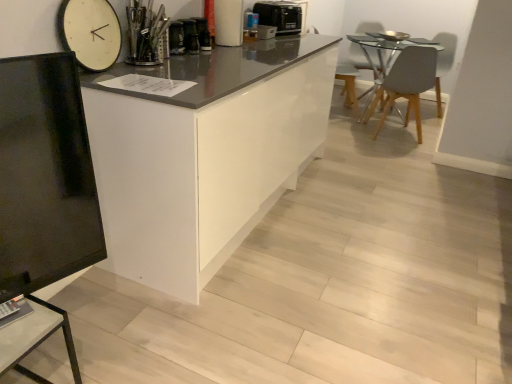
The image size is (512, 384). What do you see at coordinates (281, 15) in the screenshot? I see `black plastic toaster at upper center` at bounding box center [281, 15].

This screenshot has height=384, width=512. What are the coordinates of `white glossy cabinet at center` in the screenshot? It's located at (204, 154).

The width and height of the screenshot is (512, 384). In order to click on matte black tv stand at lower left in this screenshot , I will do `click(35, 339)`.

Looking at this image, how much space does matte gray swivel chair at upper right, the first swivel chair viewed from the right, occupy vertically?

matte gray swivel chair at upper right, the first swivel chair viewed from the right, is 31.94 inches tall.

At what (x,y) coordinates should I click in order to perform the action: click on matte gray swivel chair at upper right, the first swivel chair in the left-to-right sequence. Please return your answer as a coordinate pair (x, y). The height and width of the screenshot is (384, 512). Looking at the image, I should click on (362, 57).

At what (x,y) coordinates should I click in order to perform the action: click on gray matte chair at right. Please return your answer as a coordinate pair (x, y). The width and height of the screenshot is (512, 384). Looking at the image, I should click on (406, 84).

From a real-world perspective, who is located lower, matte gray swivel chair at upper right, the second swivel chair from the right, or matte black tv stand at lower left?

matte black tv stand at lower left.

Is matte gray swivel chair at upper right, the second swivel chair from the right, outside of matte black tv stand at lower left?

matte gray swivel chair at upper right, the second swivel chair from the right, is positioned outside matte black tv stand at lower left.

Is matte gray swivel chair at upper right, the second swivel chair from the right, wider than matte black tv stand at lower left?

Correct, the width of matte gray swivel chair at upper right, the second swivel chair from the right, exceeds that of matte black tv stand at lower left.

Is matte gray swivel chair at upper right, the first swivel chair in the left-to-right sequence, taller than matte black tv stand at lower left?

Indeed, matte gray swivel chair at upper right, the first swivel chair in the left-to-right sequence, has a greater height compared to matte black tv stand at lower left.

Which is farther, (119, 34) or (445, 59)?

The point (445, 59) is behind.

Does white wooden clock at upper left come behind matte gray swivel chair at upper right, the 2th swivel chair positioned from the left?

No, it is in front of matte gray swivel chair at upper right, the 2th swivel chair positioned from the left.

Can you confirm if white wooden clock at upper left is wider than matte gray swivel chair at upper right, the 2th swivel chair positioned from the left?

Incorrect, the width of white wooden clock at upper left does not surpass that of matte gray swivel chair at upper right, the 2th swivel chair positioned from the left.

How different are the orientations of white wooden clock at upper left and matte gray swivel chair at upper right, the 2th swivel chair positioned from the left, in degrees?

They differ by 132 degrees in their facing directions.

Considering the relative sizes of matte gray swivel chair at upper right, the 2th swivel chair positioned from the left, and matte gray swivel chair at upper right, the second swivel chair from the right, in the image provided, is matte gray swivel chair at upper right, the 2th swivel chair positioned from the left, thinner than matte gray swivel chair at upper right, the second swivel chair from the right,?

Yes.

Is matte gray swivel chair at upper right, the 2th swivel chair positioned from the left, taller than matte gray swivel chair at upper right, the first swivel chair in the left-to-right sequence?

No, matte gray swivel chair at upper right, the 2th swivel chair positioned from the left, is not taller than matte gray swivel chair at upper right, the first swivel chair in the left-to-right sequence.

Can you confirm if matte gray swivel chair at upper right, the 2th swivel chair positioned from the left, is positioned to the right of matte gray swivel chair at upper right, the first swivel chair in the left-to-right sequence?

Correct, you'll find matte gray swivel chair at upper right, the 2th swivel chair positioned from the left, to the right of matte gray swivel chair at upper right, the first swivel chair in the left-to-right sequence.

Is the depth of matte gray swivel chair at upper right, the first swivel chair viewed from the right, less than that of matte gray swivel chair at upper right, the second swivel chair from the right?

That is True.

How far apart are gray matte chair at right and white glossy cabinet at center?

gray matte chair at right is 5.50 feet away from white glossy cabinet at center.

Who is more distant, gray matte chair at right or white glossy cabinet at center?

Positioned behind is gray matte chair at right.

From a real-world perspective, is gray matte chair at right positioned over white glossy cabinet at center based on gravity?

No, from a real-world perspective, gray matte chair at right is not over white glossy cabinet at center

In terms of width, does gray matte chair at right look wider or thinner when compared to white glossy cabinet at center?

Considering their sizes, gray matte chair at right looks slimmer than white glossy cabinet at center.

Is black plastic toaster at upper center wider or thinner than white wooden clock at upper left?

black plastic toaster at upper center is wider than white wooden clock at upper left.

From a real-world perspective, does black plastic toaster at upper center stand above white wooden clock at upper left?

Actually, black plastic toaster at upper center is physically below white wooden clock at upper left in the real world.

Consider the image. Does black plastic toaster at upper center come in front of white wooden clock at upper left?

No.

In the image, there is a white wooden clock at upper left. Where is `appliance above it (from the image's perspective)`? This screenshot has height=384, width=512. appliance above it (from the image's perspective) is located at coordinates (281, 15).

Looking at their sizes, would you say matte black tv stand at lower left is wider or thinner than matte gray swivel chair at upper right, the first swivel chair in the left-to-right sequence?

Clearly, matte black tv stand at lower left has less width compared to matte gray swivel chair at upper right, the first swivel chair in the left-to-right sequence.

Is matte black tv stand at lower left outside of matte gray swivel chair at upper right, the first swivel chair in the left-to-right sequence?

Yes, matte black tv stand at lower left is not within matte gray swivel chair at upper right, the first swivel chair in the left-to-right sequence.

From the image's perspective, which one is positioned lower, matte black tv stand at lower left or matte gray swivel chair at upper right, the first swivel chair in the left-to-right sequence?

matte black tv stand at lower left.

Based on the photo, from a real-world perspective, is gray matte chair at right below matte gray swivel chair at upper right, the second swivel chair from the right?

Yes, from a real-world perspective, gray matte chair at right is under matte gray swivel chair at upper right, the second swivel chair from the right.

Which of these two, gray matte chair at right or matte gray swivel chair at upper right, the first swivel chair in the left-to-right sequence, stands taller?

Standing taller between the two is matte gray swivel chair at upper right, the first swivel chair in the left-to-right sequence.

Is point (374, 135) positioned after point (378, 65)?

No, (374, 135) is closer to viewer.

Does gray matte chair at right have a larger size compared to matte gray swivel chair at upper right, the first swivel chair in the left-to-right sequence?

No, gray matte chair at right is not bigger than matte gray swivel chair at upper right, the first swivel chair in the left-to-right sequence.

You are a GUI agent. You are given a task and a screenshot of the screen. Output one action in this format:
    pyautogui.click(x=<x>, y=<y>)
    Task: Click on the table that appears below the matte gray swivel chair at upper right, the second swivel chair from the right (from the image's perspective)
    This screenshot has height=384, width=512.
    Given the screenshot: What is the action you would take?
    pyautogui.click(x=35, y=339)

This screenshot has height=384, width=512. What are the coordinates of `the 1st swivel chair above the white wooden clock at upper left (from the image's perspective)` in the screenshot? It's located at (441, 60).

Which object lies nearer to the anchor point white glossy cabinet at center, gray matte chair at right or matte gray swivel chair at upper right, the first swivel chair in the left-to-right sequence?

gray matte chair at right.

Which object lies further to the anchor point white glossy cabinet at center, matte black tv stand at lower left or gray matte chair at right?

Among the two, gray matte chair at right is located further to white glossy cabinet at center.

Based on their spatial positions, is matte black tv stand at lower left or white glossy cabinet at center closer to matte gray swivel chair at upper right, the first swivel chair viewed from the right?

Among the two, white glossy cabinet at center is located nearer to matte gray swivel chair at upper right, the first swivel chair viewed from the right.

Based on their spatial positions, is matte gray swivel chair at upper right, the second swivel chair from the right, or matte black tv stand at lower left closer to white glossy cabinet at center?

Among the two, matte black tv stand at lower left is located nearer to white glossy cabinet at center.

Consider the image. From the image, which object appears to be nearer to gray matte chair at right, white wooden clock at upper left or black plastic toaster at upper center?

The object closer to gray matte chair at right is black plastic toaster at upper center.

Estimate the real-world distances between objects in this image. Which object is further from gray matte chair at right, black plastic toaster at upper center or white wooden clock at upper left?

white wooden clock at upper left.

From the image, which object appears to be nearer to white wooden clock at upper left, white glossy cabinet at center or black plastic toaster at upper center?

white glossy cabinet at center.

Considering their positions, is black plastic toaster at upper center positioned closer to matte black tv stand at lower left than white glossy cabinet at center?

white glossy cabinet at center.

This screenshot has height=384, width=512. Identify the location of cabinetry located between matte black tv stand at lower left and matte gray swivel chair at upper right, the first swivel chair in the left-to-right sequence, in the depth direction. (204, 154).

This screenshot has width=512, height=384. I want to click on appliance between white glossy cabinet at center and gray matte chair at right from front to back, so click(281, 15).

Find the location of a particular element. The image size is (512, 384). clock between matte black tv stand at lower left and matte gray swivel chair at upper right, the second swivel chair from the right, from front to back is located at coordinates (90, 33).

What are the coordinates of `chair between black plastic toaster at upper center and matte gray swivel chair at upper right, the 2th swivel chair positioned from the left, in the horizontal direction` in the screenshot? It's located at (406, 84).